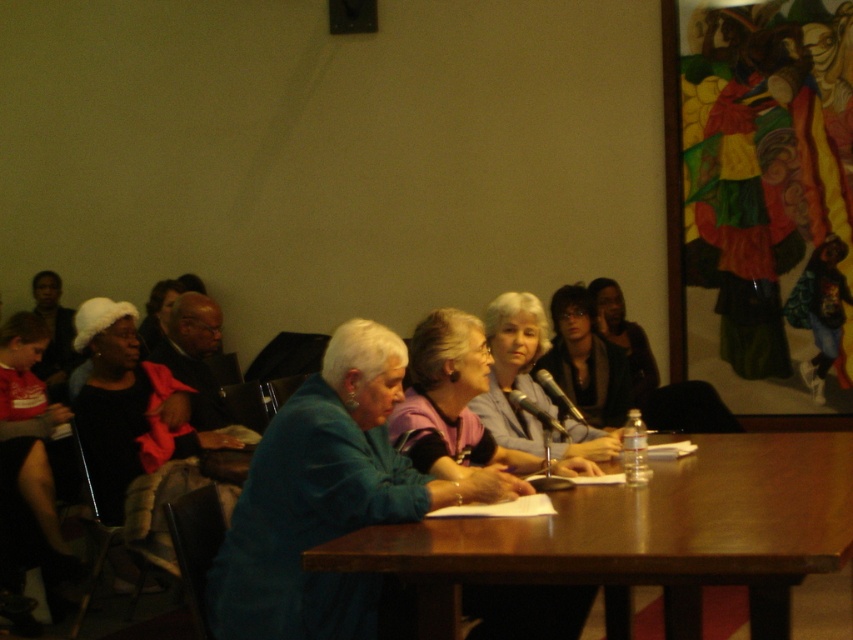
You are organizing a charity event and need to decide which of the two items, the blue fabric jacket at center or the smooth gray sweater at center, can fit into a donation box that has a maximum capacity of 0.5 cubic feet. Based on their sizes, which item is more likely to fit?

The blue fabric jacket at center is smaller than the smooth gray sweater at center, so it is more likely to fit into the donation box with a maximum capacity of 0.5 cubic feet.

You are standing at the center of the room and see a point marked at coordinates [450,401]. Which object does this point lie on?

The point at coordinates [450,401] lies on the blue fabric jacket at center.

You are a photographer preparing to take a group photo of the meeting participants. You notice the blue fabric jacket at center and the smooth gray sweater at center. Which clothing item should you focus on first to ensure it is in sharp focus if you want to prioritize the one closer to the camera?

The blue fabric jacket at center is located below the smooth gray sweater at center, indicating it is closer to the camera. Therefore, you should focus on the blue fabric jacket at center first to ensure it is in sharp focus.